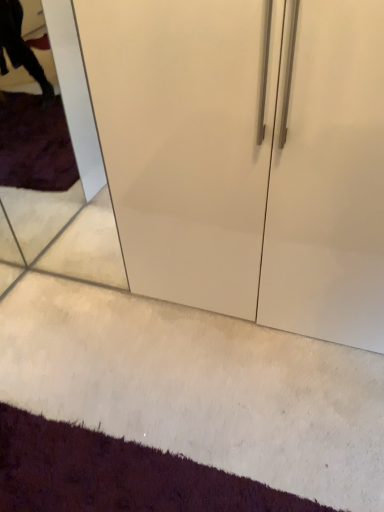
At what (x,y) coordinates should I click in order to perform the action: click on free space above dark purple carpet at lower left (from a real-world perspective). Please return your answer as a coordinate pair (x, y). Looking at the image, I should click on click(56, 460).